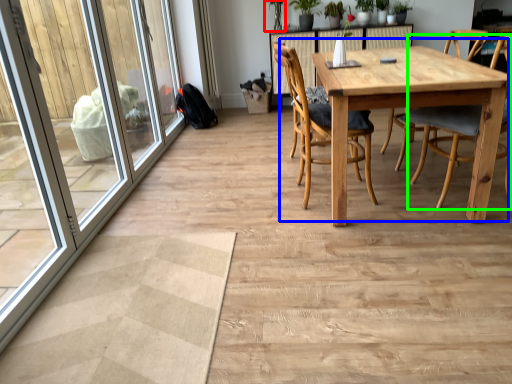
Question: Which object is the farthest from plant (highlighted by a red box)? Choose among these: kitchen & dining room table (highlighted by a blue box) or chair (highlighted by a green box).

Choices:
 (A) kitchen & dining room table
 (B) chair

Answer: (B)